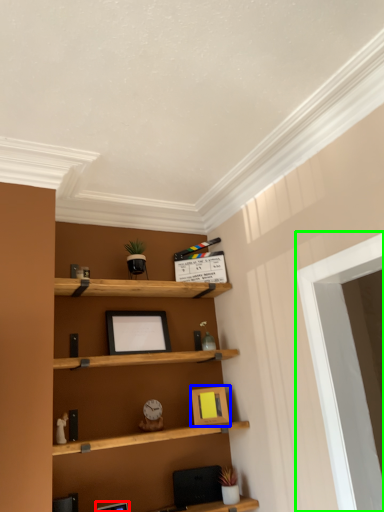
Question: Which is nearer to the picture frame (highlighted by a red box)? picture frame (highlighted by a blue box) or window (highlighted by a green box).

Choices:
 (A) picture frame
 (B) window

Answer: (A)